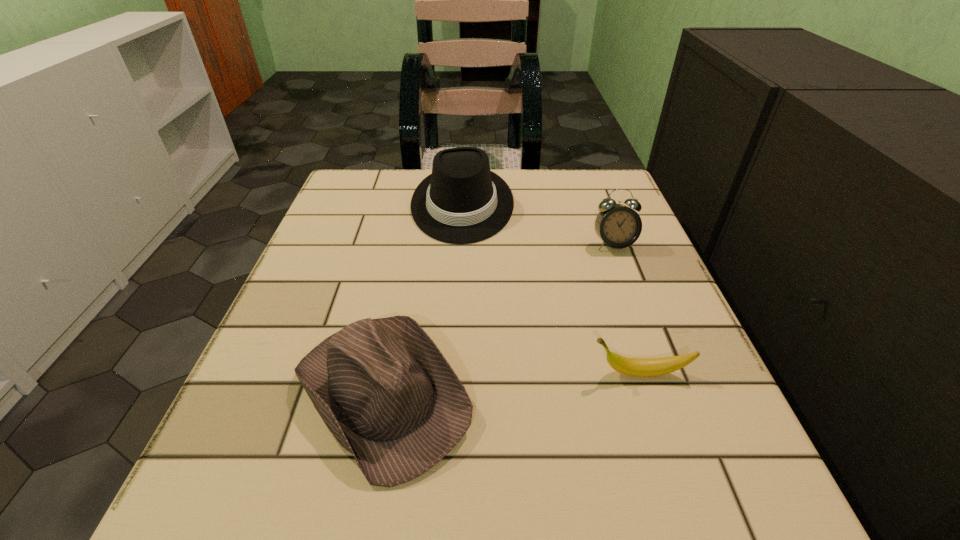
Where is `empty space between the alarm clock and the nearer fedora`? empty space between the alarm clock and the nearer fedora is located at coordinates (498, 318).

This screenshot has height=540, width=960. In order to click on vacant area that lies between the alarm clock and the nearer fedora in this screenshot , I will do `click(498, 318)`.

The image size is (960, 540). Find the location of `object that is the nearest to the farther fedora`. object that is the nearest to the farther fedora is located at coordinates (618, 226).

Identify the location of object that is the closest to the nearer fedora. This screenshot has width=960, height=540. (641, 367).

Locate an element on the screen. vacant area that satisfies the following two spatial constraints: 1. on the face of the alarm clock; 2. at the stem of the shortest object is located at coordinates (662, 373).

This screenshot has width=960, height=540. Find the location of `free spot that satisfies the following two spatial constraints: 1. on the face of the alarm clock; 2. at the stem of the shortest object`. free spot that satisfies the following two spatial constraints: 1. on the face of the alarm clock; 2. at the stem of the shortest object is located at coordinates (662, 373).

I want to click on vacant space that satisfies the following two spatial constraints: 1. on the face of the alarm clock; 2. at the stem of the shortest object, so click(x=662, y=373).

In order to click on blank space that satisfies the following two spatial constraints: 1. at the stem of the banana; 2. on the front side of the nearer fedora in this screenshot , I will do `click(646, 392)`.

Locate an element on the screen. The image size is (960, 540). free space that satisfies the following two spatial constraints: 1. at the stem of the shortest object; 2. on the front side of the nearer fedora is located at coordinates (646, 392).